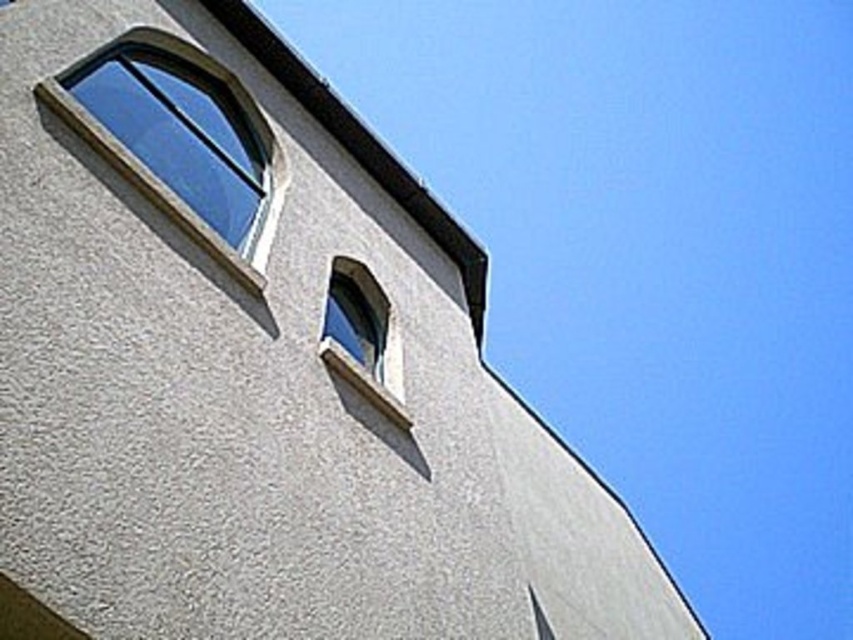
Does point (242, 129) lie behind point (370, 346)?

Yes, point (242, 129) is behind point (370, 346).

This screenshot has width=853, height=640. In order to click on clear glass window at upper left in this screenshot , I will do coord(180,140).